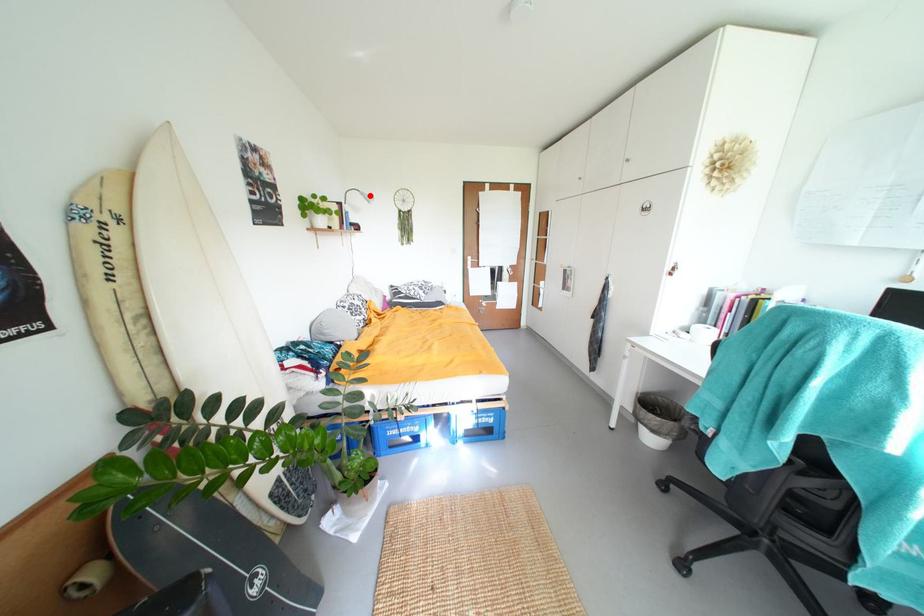
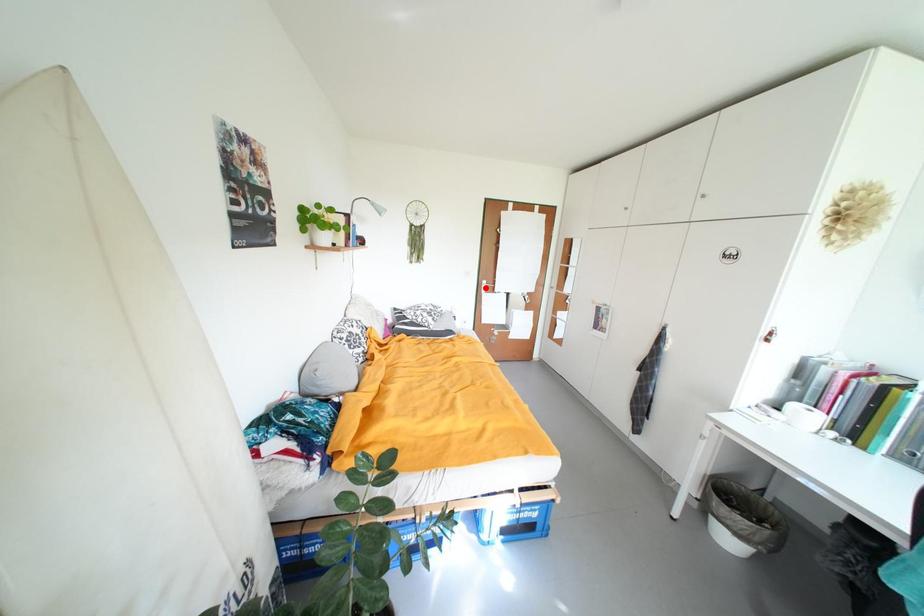
I am providing you with two images of the same scene from different viewpoints. A red point is marked on the first image and another point is marked on the second image. Is the marked point in image1 the same physical position as the marked point in image2?

No